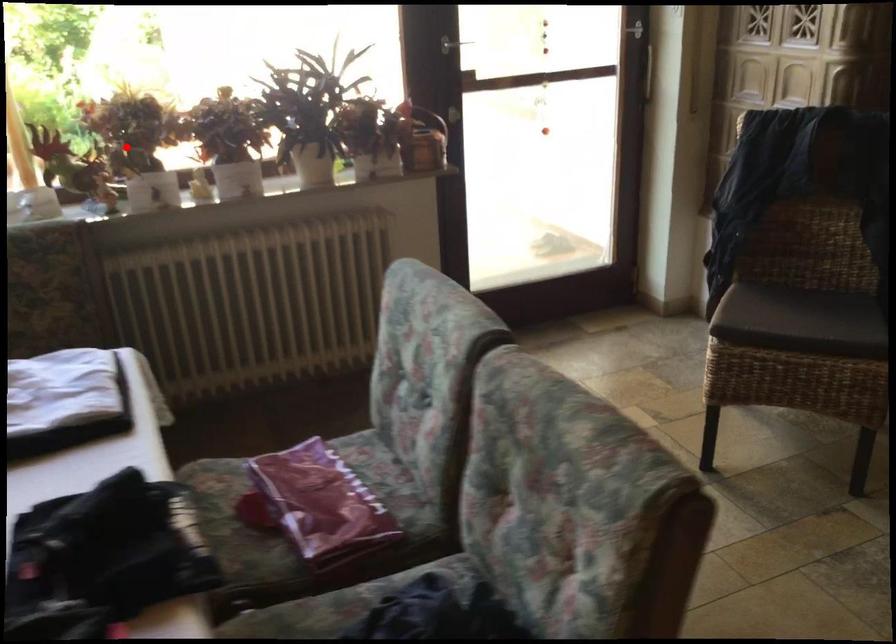
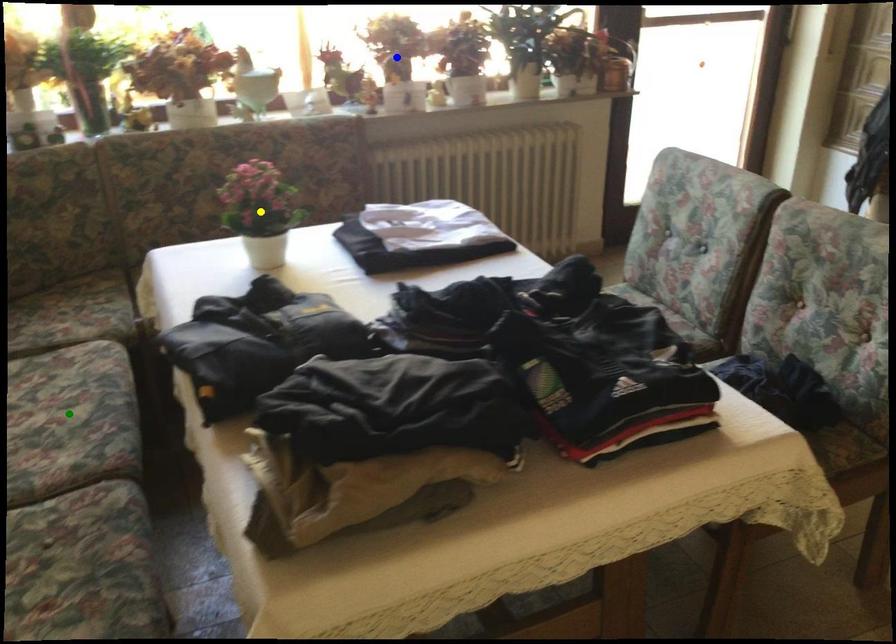
Question: I am providing you with two images of the same scene from different viewpoints. A red point is marked on the first image. You are given multiple points on the second image. In image 2, which mark is for the same physical point as the one in image 1?

Choices:
 (A) yellow point
 (B) green point
 (C) blue point

Answer: (C)